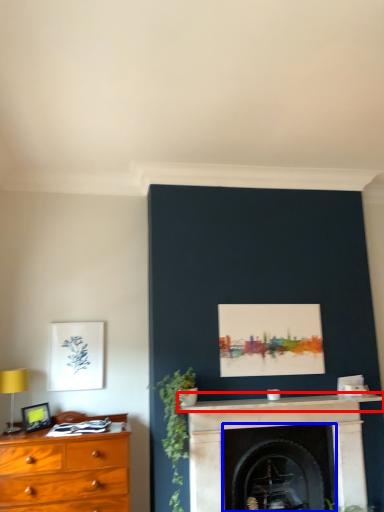
Question: Which object appears closest to the camera in this image, mantle (highlighted by a red box) or fireplace (highlighted by a blue box)?

Choices:
 (A) mantle
 (B) fireplace

Answer: (A)